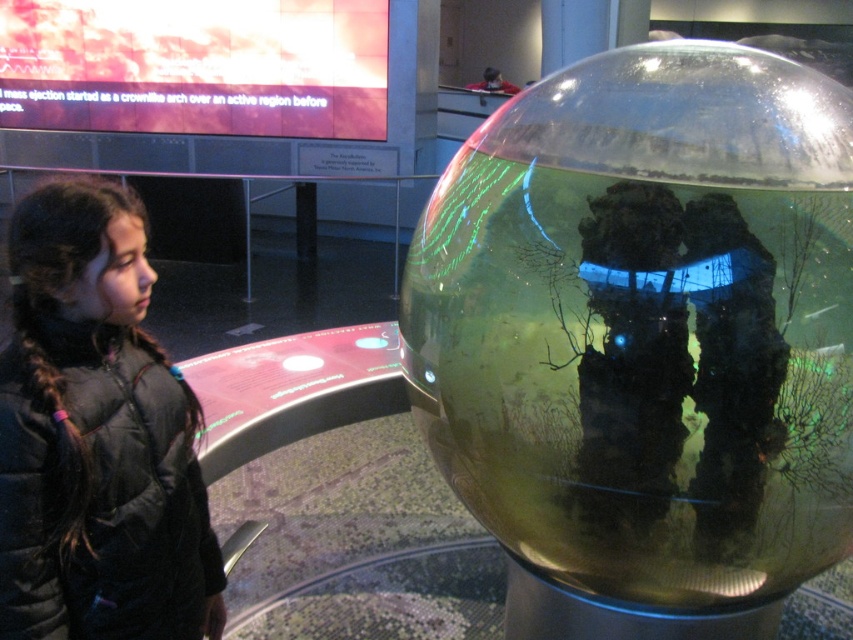
Question: Can you confirm if transparent glass sphere at center is smaller than black puffy jacket at left?

Choices:
 (A) yes
 (B) no

Answer: (B)

Question: Which of the following is the farthest from the observer?

Choices:
 (A) transparent glass sphere at center
 (B) black puffy jacket at left

Answer: (B)

Question: Which point is closer to the camera?

Choices:
 (A) (78, 598)
 (B) (723, 429)

Answer: (B)

Question: Does transparent glass sphere at center appear over black puffy jacket at left?

Choices:
 (A) yes
 (B) no

Answer: (A)

Question: In this image, where is transparent glass sphere at center located relative to black puffy jacket at left?

Choices:
 (A) above
 (B) below

Answer: (A)